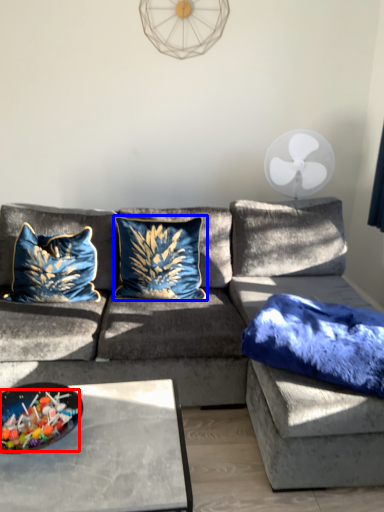
Question: Which point is closer to the camera, food (highlighted by a red box) or pillow (highlighted by a blue box)?

Choices:
 (A) food
 (B) pillow

Answer: (A)